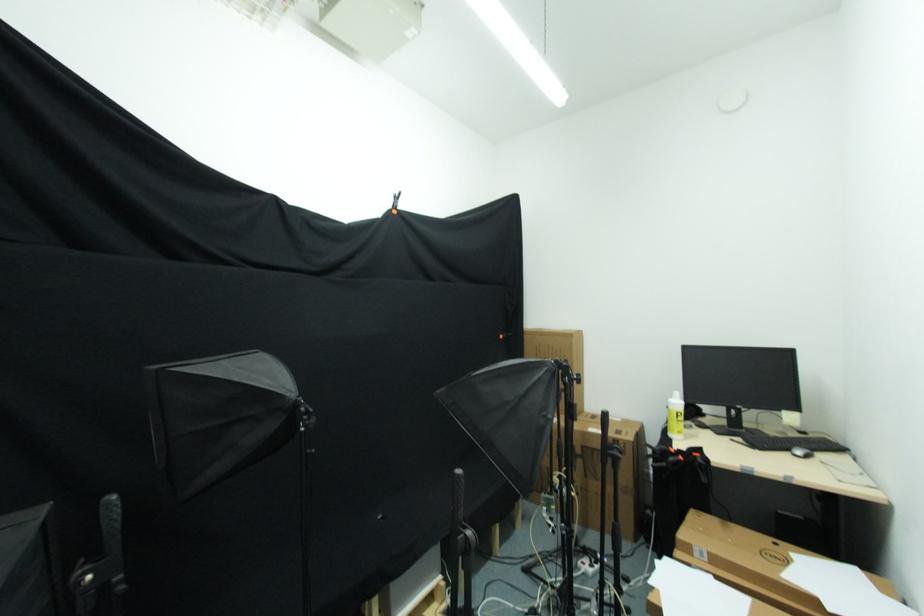
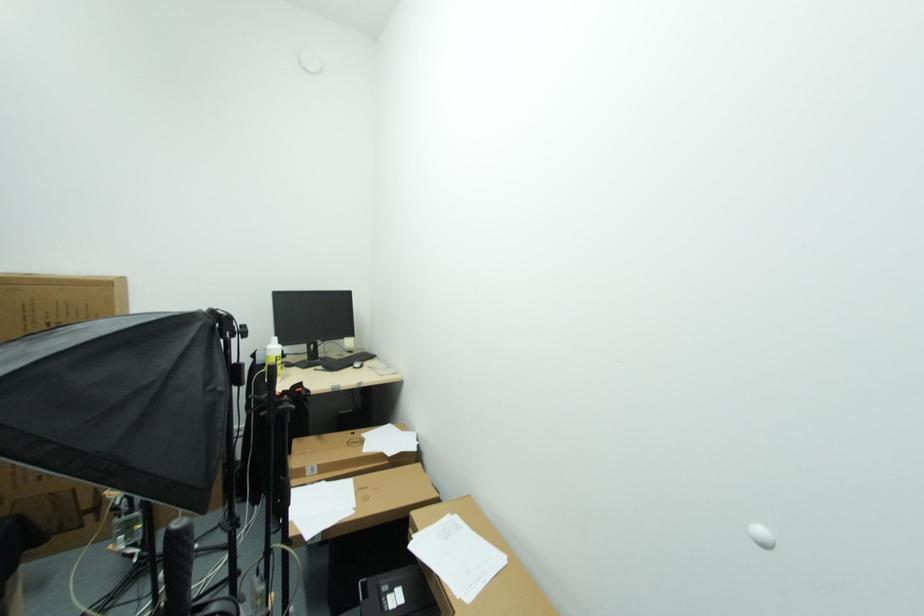
Question: The camera is either moving clockwise (left) or counter-clockwise (right) around the object. The first image is from the beginning of the video and the second image is from the end. Is the camera moving left or right when shooting the video?

Choices:
 (A) Left
 (B) Right

Answer: (A)